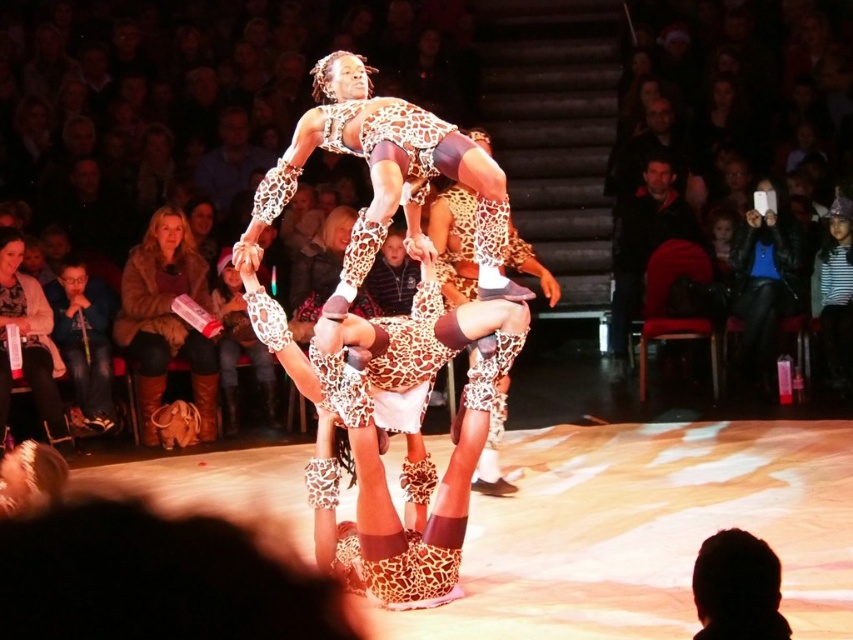
You are standing in the audience watching the acrobats. You want to throw a small flower bouquet to the performer wearing the leather boots at lower left. The throwing distance is limited to 35 feet. Can you reach them?

The leather boots at lower left are 36.73 feet away from the viewer, which exceeds the 35 feet throwing distance limit. You cannot reach them.

You are a stagehand standing at the camera position. You need to place a spotlight exactly at point (x=210, y=401). The spotlight has a minimum range of 10 meters. Can you confirm if the spotlight will reach that point?

The point (x=210, y=401) is 11.51 meters from the camera, so yes, the spotlight can reach it since its distance is beyond the minimum range of 10 meters.

You are a stagehand preparing to place a new prop on the stage. The stage has a coordinate system where the bottom left corner is at point 0,0 and the top right corner is at point 1,1. You need to place the prop exactly where the leather boots at lower left are currently located. What coordinates should you use?

The coordinates for the leather boots at lower left are at point (166, 321), so you should place the prop at those coordinates.